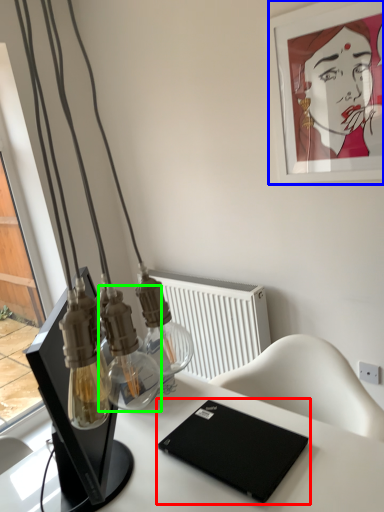
Question: Which object is positioned closest to laptop (highlighted by a red box)? Select from picture frame (highlighted by a blue box) and bottle (highlighted by a green box).

Choices:
 (A) picture frame
 (B) bottle

Answer: (B)